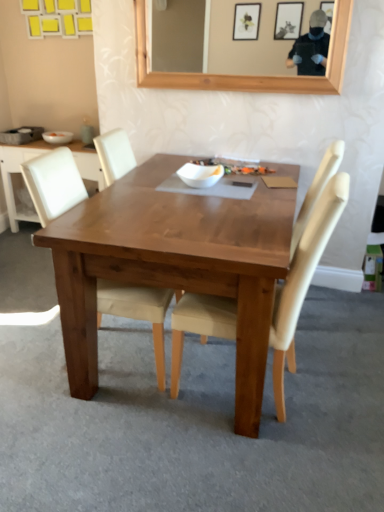
Question: Can we say matte gray coffee cup at upper left lies outside white matte bowl at center, acting as the 1th bowl starting from the right?

Choices:
 (A) no
 (B) yes

Answer: (B)

Question: Is the surface of matte gray coffee cup at upper left in direct contact with white matte bowl at center, placed as the 1th bowl when sorted from front to back?

Choices:
 (A) yes
 (B) no

Answer: (B)

Question: Is matte gray coffee cup at upper left not near white matte bowl at center, which is the 2th bowl in back-to-front order?

Choices:
 (A) no
 (B) yes

Answer: (B)

Question: Considering the relative sizes of matte gray coffee cup at upper left and white matte bowl at center, which appears as the first bowl when ordered from the bottom, in the image provided, is matte gray coffee cup at upper left wider than white matte bowl at center, which appears as the first bowl when ordered from the bottom,?

Choices:
 (A) no
 (B) yes

Answer: (B)

Question: Does matte gray coffee cup at upper left have a lesser width compared to white matte bowl at center, acting as the 1th bowl starting from the right?

Choices:
 (A) yes
 (B) no

Answer: (B)

Question: Is matte gray coffee cup at upper left to the right of white matte bowl at center, which is the 2th bowl in back-to-front order, from the viewer's perspective?

Choices:
 (A) no
 (B) yes

Answer: (A)

Question: Is light beige fabric chair at center, which is counted as the 2th chair, starting from the right, inside white matte bowl at upper left, which ranks as the 1th bowl in left-to-right order?

Choices:
 (A) yes
 (B) no

Answer: (B)

Question: Is white matte bowl at upper left, the second bowl when ordered from right to left, smaller than light beige fabric chair at center, which appears as the 1th chair when viewed from the left?

Choices:
 (A) yes
 (B) no

Answer: (A)

Question: Does white matte bowl at upper left, which is the second bowl in front-to-back order, have a lesser width compared to light beige fabric chair at center, which is counted as the 2th chair, starting from the right?

Choices:
 (A) no
 (B) yes

Answer: (B)

Question: Is white matte bowl at upper left, which is the first bowl in top-to-bottom order, shorter than light beige fabric chair at center, which is counted as the 2th chair, starting from the right?

Choices:
 (A) no
 (B) yes

Answer: (B)

Question: From the image's perspective, is white matte bowl at upper left, which ranks as the 1th bowl in left-to-right order, located beneath light beige fabric chair at center, which is counted as the 2th chair, starting from the right?

Choices:
 (A) yes
 (B) no

Answer: (B)

Question: Is white matte bowl at upper left, which is the second bowl in front-to-back order, bigger than light beige fabric chair at center, which is counted as the 2th chair, starting from the right?

Choices:
 (A) yes
 (B) no

Answer: (B)

Question: From the image's perspective, is light beige fabric chair at center, which appears as the 1th chair when viewed from the left, beneath matte gray coffee cup at upper left?

Choices:
 (A) no
 (B) yes

Answer: (B)